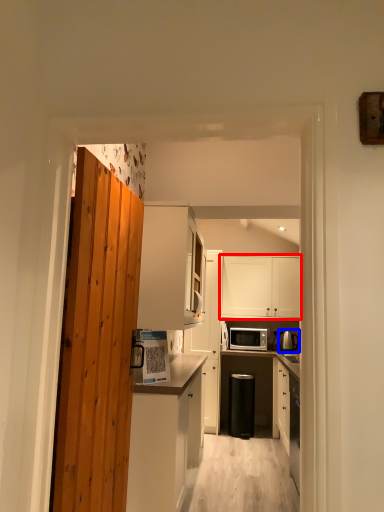
Question: Which object appears closest to the camera in this image, cabinetry (highlighted by a red box) or appliance (highlighted by a blue box)?

Choices:
 (A) cabinetry
 (B) appliance

Answer: (B)